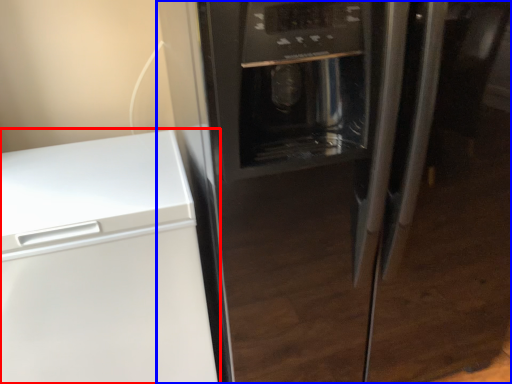
Question: Which object appears farthest to the camera in this image, home appliance (highlighted by a red box) or refrigerator (highlighted by a blue box)?

Choices:
 (A) home appliance
 (B) refrigerator

Answer: (A)